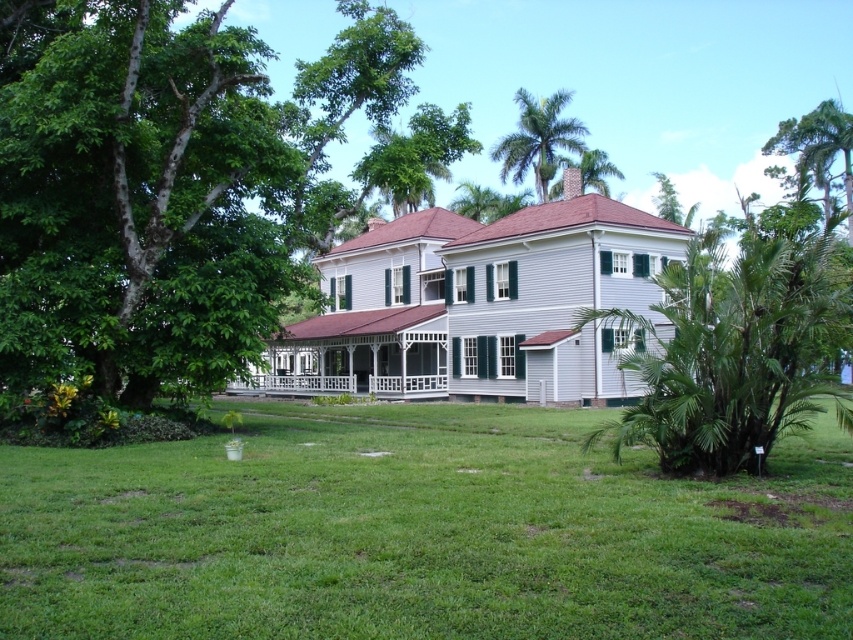
Question: Which point is closer to the camera taking this photo?

Choices:
 (A) (144, 556)
 (B) (744, 276)
 (C) (489, 220)

Answer: (A)

Question: In this image, where is green grass at center located relative to green leafy palm tree at upper center?

Choices:
 (A) below
 (B) above

Answer: (A)

Question: Can you confirm if green leafy palm tree at right is wider than green leafy tree at upper center?

Choices:
 (A) yes
 (B) no

Answer: (A)

Question: Does green leafy tree at upper center appear on the right side of green leafy palm tree at upper center?

Choices:
 (A) yes
 (B) no

Answer: (B)

Question: Which point is closer to the camera?

Choices:
 (A) green leafy palm tree at right
 (B) green leafy palm tree at upper center

Answer: (A)

Question: Which object is the farthest from the green leafy palm tree at right?

Choices:
 (A) green leafy tree at upper center
 (B) green leafy palm tree at upper center
 (C) green grass at center

Answer: (B)